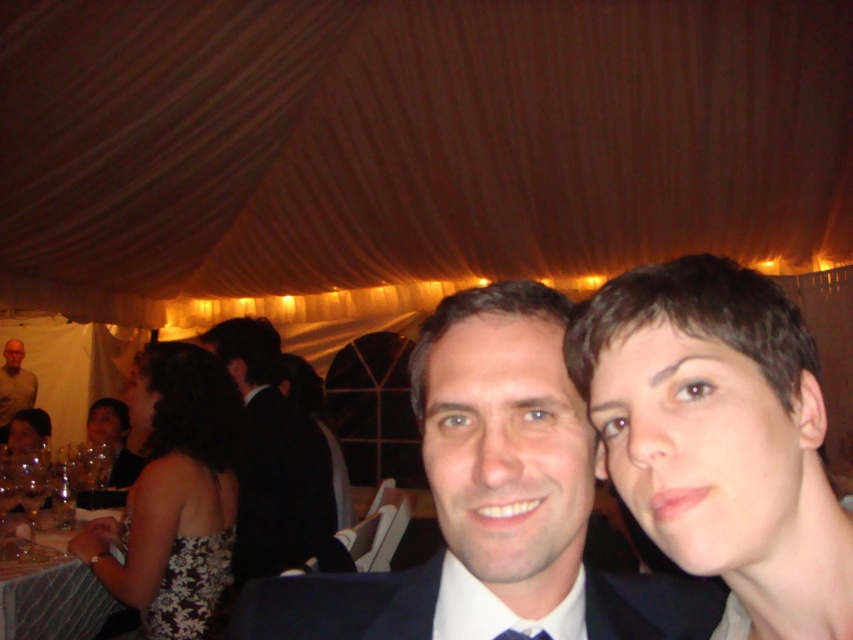
You are standing 10 inches away from the short hair at center. If you take one step forward, will you be closer than the distance specified in the description?

The distance of short hair at center from viewer is 15.36 inches. If you take one step forward from 10 inches away, you will be 5 inches away, which is closer than the specified distance.

You are a photographer at the event and want to capture a photo of both the short hair at center and the light brown shirt at left. Which object should you focus on first if you want to ensure both are in sharp focus?

Since the short hair at center is positioned over the light brown shirt at left, you should focus on the light brown shirt at left first to ensure both are in sharp focus.